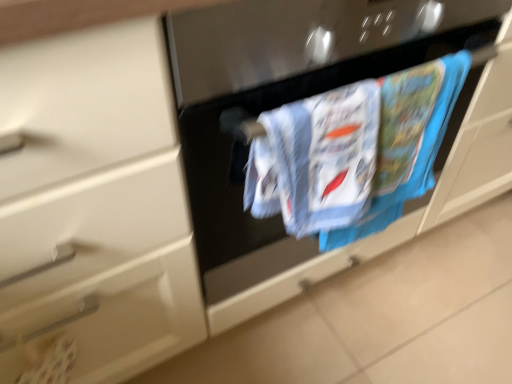
Find the location of a particular element. The image size is (512, 384). printed cotton towel at center is located at coordinates (407, 141).

What is the approximate width of printed cotton towel at center?

printed cotton towel at center is 3.09 inches wide.

In order to face printed cotton towel at center, should I rotate leftwards or rightwards?

It's best to rotate right around 12.775 degrees.

The height and width of the screenshot is (384, 512). What do you see at coordinates (407, 141) in the screenshot?
I see `printed cotton towel at center` at bounding box center [407, 141].

Find the location of a particular element. This screenshot has width=512, height=384. white plastic door handle at lower left is located at coordinates (57, 322).

Describe the element at coordinates (57, 322) in the screenshot. I see `white plastic door handle at lower left` at that location.

This screenshot has width=512, height=384. In order to click on printed cotton towel at center in this screenshot , I will do `click(407, 141)`.

Visually, is white plastic door handle at lower left positioned to the left or to the right of printed cotton towel at center?

In the image, white plastic door handle at lower left appears on the left side of printed cotton towel at center.

Is white plastic door handle at lower left further to camera compared to printed cotton towel at center?

Yes, it is behind printed cotton towel at center.

Is point (88, 308) closer or farther from the camera than point (421, 82)?

Point (88, 308).

From the image's perspective, which is above, white plastic door handle at lower left or printed cotton towel at center?

printed cotton towel at center is shown above in the image.

From a real-world perspective, which is physically above, white plastic door handle at lower left or printed cotton towel at center?

In real-world perspective, printed cotton towel at center is above.

Considering the sizes of white plastic door handle at lower left and printed cotton towel at center in the image, is white plastic door handle at lower left wider or thinner than printed cotton towel at center?

Clearly, white plastic door handle at lower left has less width compared to printed cotton towel at center.

Who is taller, white plastic door handle at lower left or printed cotton towel at center?

Standing taller between the two is printed cotton towel at center.

Looking at the image, does white plastic door handle at lower left seem bigger or smaller compared to printed cotton towel at center?

Considering their sizes, white plastic door handle at lower left takes up less space than printed cotton towel at center.

In the scene shown: Is white plastic door handle at lower left inside the boundaries of printed cotton towel at center, or outside?

white plastic door handle at lower left exists outside the volume of printed cotton towel at center.

Are white plastic door handle at lower left and printed cotton towel at center making contact?

white plastic door handle at lower left is not next to printed cotton towel at center, and they're not touching.

In the scene shown: Is white plastic door handle at lower left looking in the opposite direction of printed cotton towel at center?

No.

You are a GUI agent. You are given a task and a screenshot of the screen. Output one action in this format:
    pyautogui.click(x=<x>, y=<y>)
    Task: Click on the door handle lying on the left of printed cotton towel at center
    Image resolution: width=512 pixels, height=384 pixels.
    Given the screenshot: What is the action you would take?
    pyautogui.click(x=57, y=322)

Is printed cotton towel at center at the right side of white plastic door handle at lower left?

Yes.

Relative to white plastic door handle at lower left, is printed cotton towel at center in front or behind?

printed cotton towel at center is positioned closer to the viewer than white plastic door handle at lower left.

Is point (309, 128) in front of point (79, 311)?

Yes, point (309, 128) is in front of point (79, 311).

From the image's perspective, which is below, printed cotton towel at center or white plastic door handle at lower left?

white plastic door handle at lower left is shown below in the image.

From a real-world perspective, which object stands above the other?

printed cotton towel at center is physically above.

Is printed cotton towel at center wider or thinner than white plastic door handle at lower left?

Clearly, printed cotton towel at center has more width compared to white plastic door handle at lower left.

Is printed cotton towel at center shorter than white plastic door handle at lower left?

No.

In the scene shown: Who is smaller, printed cotton towel at center or white plastic door handle at lower left?

With smaller size is white plastic door handle at lower left.

Would you say printed cotton towel at center is outside white plastic door handle at lower left?

Yes, printed cotton towel at center is outside of white plastic door handle at lower left.

Is printed cotton towel at center far from white plastic door handle at lower left?

No, printed cotton towel at center is in close proximity to white plastic door handle at lower left.

Is printed cotton towel at center aimed at white plastic door handle at lower left?

No.

Locate an element on the screen. Image resolution: width=512 pixels, height=384 pixels. laundry located above the white plastic door handle at lower left (from the image's perspective) is located at coordinates (407, 141).

What are the coordinates of `laundry on the right of white plastic door handle at lower left` in the screenshot? It's located at 407,141.

This screenshot has width=512, height=384. Identify the location of door handle below the printed cotton towel at center (from the image's perspective). (57, 322).